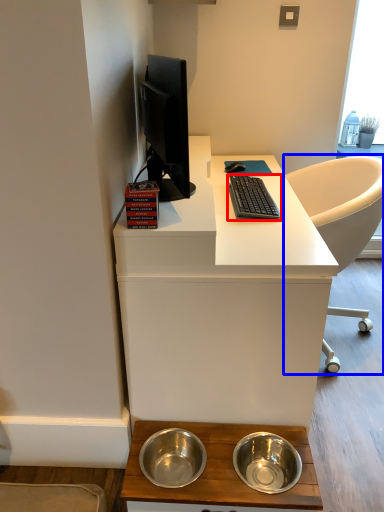
Question: Which point is closer to the camera, computer keyboard (highlighted by a red box) or chair (highlighted by a blue box)?

Choices:
 (A) computer keyboard
 (B) chair

Answer: (A)